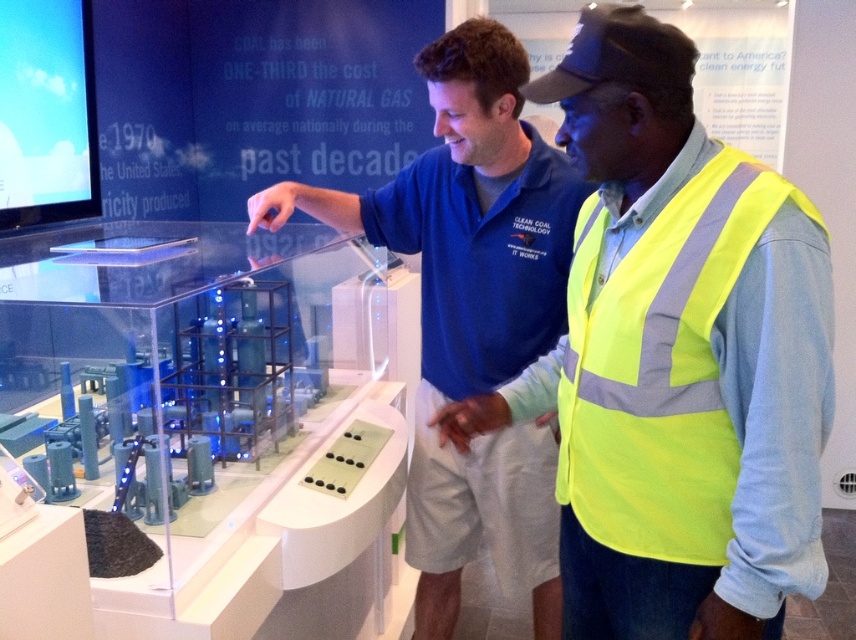
You are a safety inspector holding a 12 inch ruler. You need to measure the distance between the neon yellow safety vest at center and the camera. Can your ruler reach that distance?

The distance between the neon yellow safety vest at center and the camera is 36.32 inches. Since your ruler is only 12 inches long, it cannot reach the full distance of 36.32 inches.

You are an inspector at the energy exhibition. You need to ensure that the neon yellow safety vest at center and the neon yellow reflective vest at right are both visible from the entrance. Given that the entrance is directly in front of the center vest, which vest would be more visible to someone entering the room?

The neon yellow safety vest at center would be more visible because it is wider than the neon yellow reflective vest at right, making it stand out more from the entrance perspective.